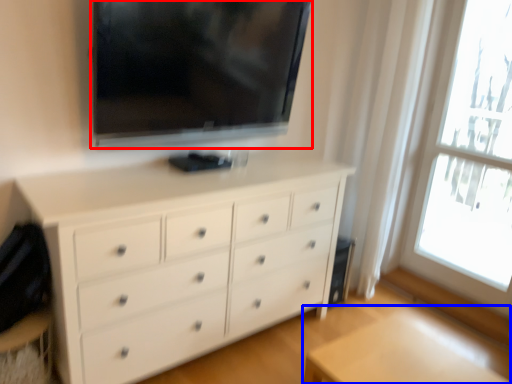
Question: Among these objects, which one is nearest to the camera, television (highlighted by a red box) or table (highlighted by a blue box)?

Choices:
 (A) television
 (B) table

Answer: (B)